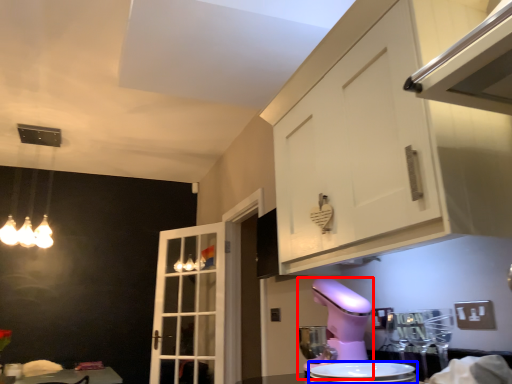
Question: Which object appears closest to the camera in this image, mixer (highlighted by a red box) or appliance (highlighted by a blue box)?

Choices:
 (A) mixer
 (B) appliance

Answer: (B)